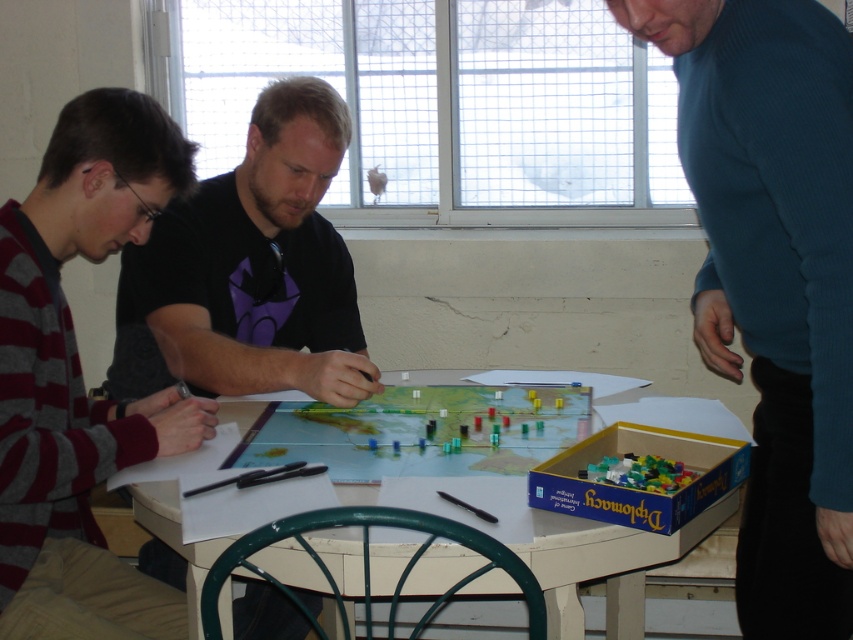
You are a player in the board game session and you need to move a piece from point A to point B. If point A is at coordinate point (718, 150) and point B is at coordinate point (21, 468), which direction should you move the piece?

You should move the piece downward and to the right because point (21, 468) is located lower and to the right of point (718, 150).